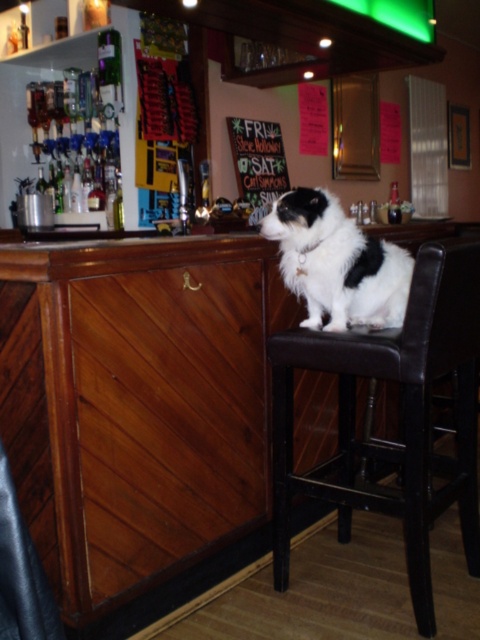
In the scene shown: Is brown leather chair at center above wooden signboard at center?

Actually, brown leather chair at center is below wooden signboard at center.

Can you confirm if brown leather chair at center is taller than wooden signboard at center?

Correct, brown leather chair at center is much taller as wooden signboard at center.

Between point (460, 436) and point (265, 198), which one is positioned in front?

Point (460, 436) is in front.

Where is `brown leather chair at center`? This screenshot has height=640, width=480. brown leather chair at center is located at coordinates (403, 416).

Can you confirm if brown leather chair at center is positioned to the right of black and white fur at center?

Indeed, brown leather chair at center is positioned on the right side of black and white fur at center.

Which is below, brown leather chair at center or black and white fur at center?

brown leather chair at center is lower down.

Is point (408, 435) less distant than point (387, 250)?

Yes, it is in front of point (387, 250).

Locate an element on the screen. brown leather chair at center is located at coordinates (403, 416).

Is black and white fur at center above wooden signboard at center?

No.

Who is taller, black and white fur at center or wooden signboard at center?

wooden signboard at center

Find the location of `black and white fur at center`. black and white fur at center is located at coordinates (336, 262).